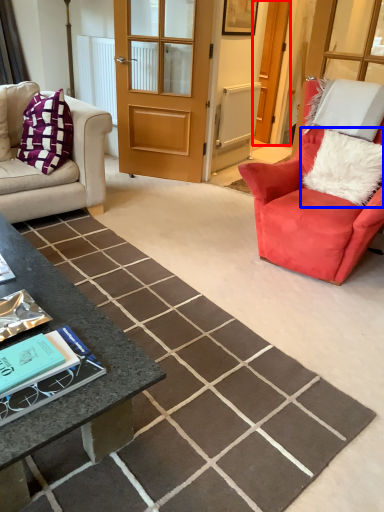
Question: Which object appears closest to the camera in this image, screen door (highlighted by a red box) or pillow (highlighted by a blue box)?

Choices:
 (A) screen door
 (B) pillow

Answer: (B)